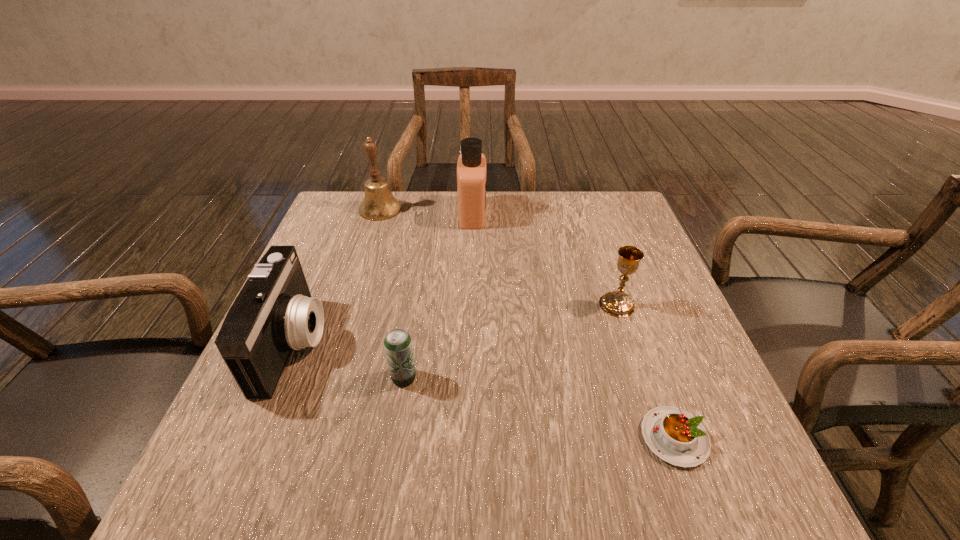
I want to click on pudding that is at the right edge, so click(675, 436).

Locate an element on the screen. The width and height of the screenshot is (960, 540). object present at the far left corner is located at coordinates pos(379,204).

Find the location of a particular element. object that is at the near right corner is located at coordinates (675, 436).

Locate an element on the screen. This screenshot has width=960, height=540. free location at the far edge of the desktop is located at coordinates 554,238.

The width and height of the screenshot is (960, 540). Find the location of `free space at the near edge of the desktop`. free space at the near edge of the desktop is located at coordinates (303, 510).

Where is `vacant space at the left edge of the desktop`? The height and width of the screenshot is (540, 960). vacant space at the left edge of the desktop is located at coordinates (319, 418).

At what (x,y) coordinates should I click in order to perform the action: click on free space at the right edge of the desktop. Please return your answer as a coordinate pair (x, y). This screenshot has height=540, width=960. Looking at the image, I should click on (669, 407).

Where is `free region at the far left corner of the desktop`? The image size is (960, 540). free region at the far left corner of the desktop is located at coordinates (x=336, y=197).

At what (x,y) coordinates should I click in order to perform the action: click on vacant space at the near right corner. Please return your answer as a coordinate pair (x, y). This screenshot has height=540, width=960. Looking at the image, I should click on 750,477.

This screenshot has height=540, width=960. What are the coordinates of `free space between the chalice and the camcorder` in the screenshot? It's located at (456, 324).